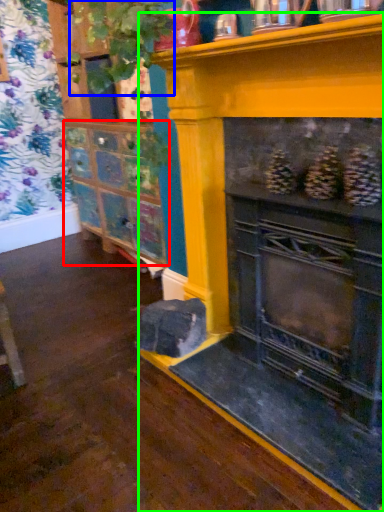
Question: Considering the real-world distances, which object is farthest from shelf (highlighted by a red box)? plant (highlighted by a blue box) or fireplace (highlighted by a green box)?

Choices:
 (A) plant
 (B) fireplace

Answer: (A)